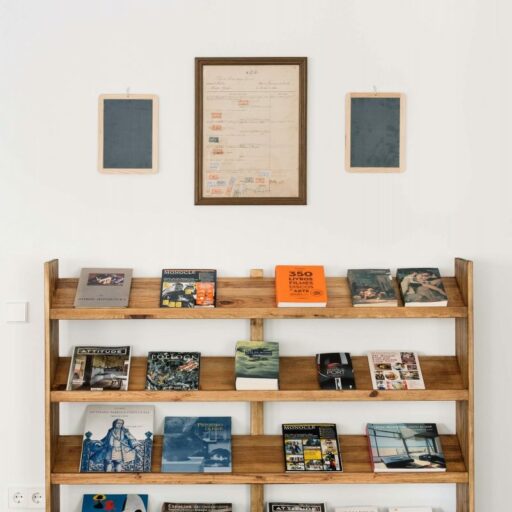
Where is `rows of books`? The image size is (512, 512). rows of books is located at coordinates (62, 297), (58, 355), (62, 444), (65, 498).